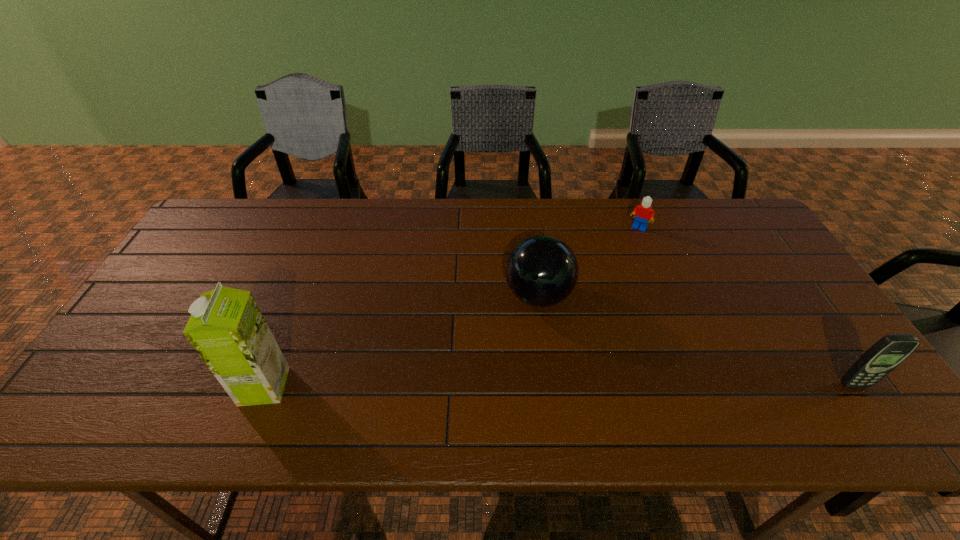
Image resolution: width=960 pixels, height=540 pixels. In order to click on free space located 0.310m on the face of the Lego in this screenshot , I will do `click(599, 291)`.

You are a GUI agent. You are given a task and a screenshot of the screen. Output one action in this format:
    pyautogui.click(x=<x>, y=<y>)
    Task: Click on the vacant space positioned on the side of the bowling ball with the finger holes
    Image resolution: width=960 pixels, height=540 pixels.
    Given the screenshot: What is the action you would take?
    click(x=500, y=381)

The image size is (960, 540). In order to click on blank space located 0.170m on the side of the bowling ball with the finger holes in this screenshot , I will do `click(505, 370)`.

I want to click on blank area located on the side of the bowling ball with the finger holes, so click(x=493, y=395).

Locate an element on the screen. Image resolution: width=960 pixels, height=540 pixels. object situated at the far edge is located at coordinates (642, 213).

The width and height of the screenshot is (960, 540). Find the location of `soya milk that is positioned at the near edge`. soya milk that is positioned at the near edge is located at coordinates (227, 329).

This screenshot has width=960, height=540. I want to click on cellular telephone present at the near edge, so click(x=885, y=355).

What are the coordinates of `object that is positioned at the right edge` in the screenshot? It's located at (885, 355).

Find the location of `object located at the near right corner`. object located at the near right corner is located at coordinates (885, 355).

In the image, there is a desktop. At what (x,y) coordinates should I click in order to perform the action: click on vacant space at the far edge. Please return your answer as a coordinate pair (x, y). The height and width of the screenshot is (540, 960). Looking at the image, I should click on (503, 229).